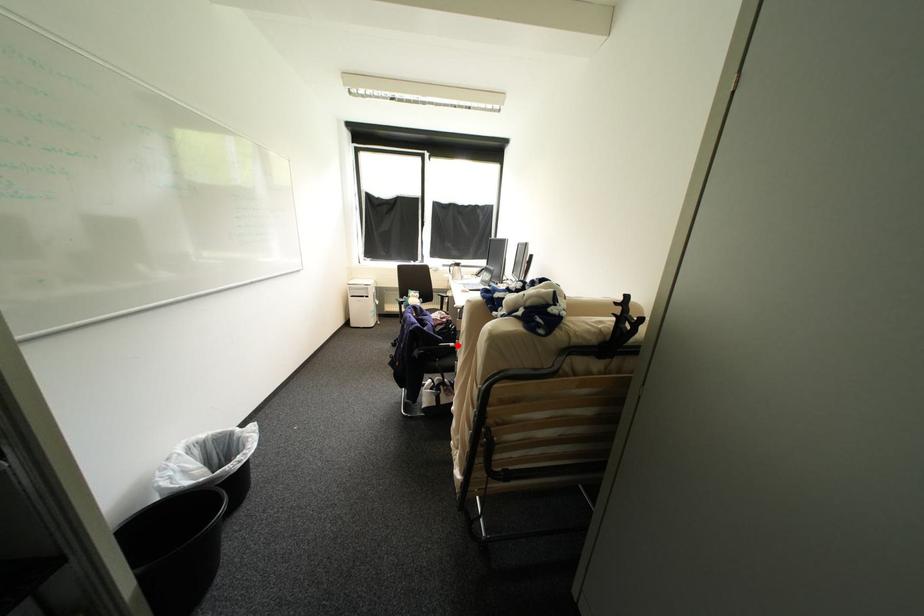
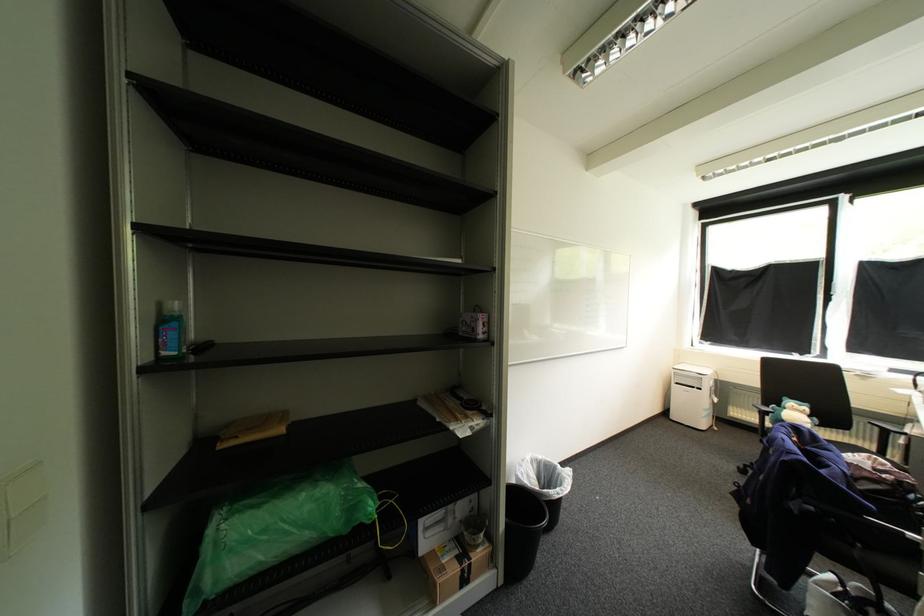
Question: I am providing you with two images of the same scene from different viewpoints. In image1, a red point is highlighted. Considering the same 3D point in image2, which of the following is correct?

Choices:
 (A) It is closer
 (B) It is farther

Answer: (B)